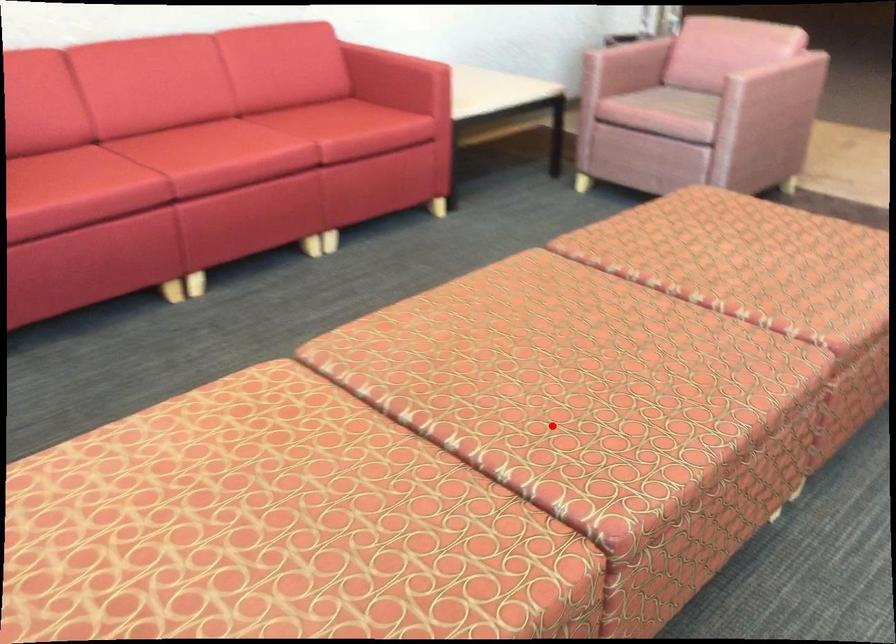
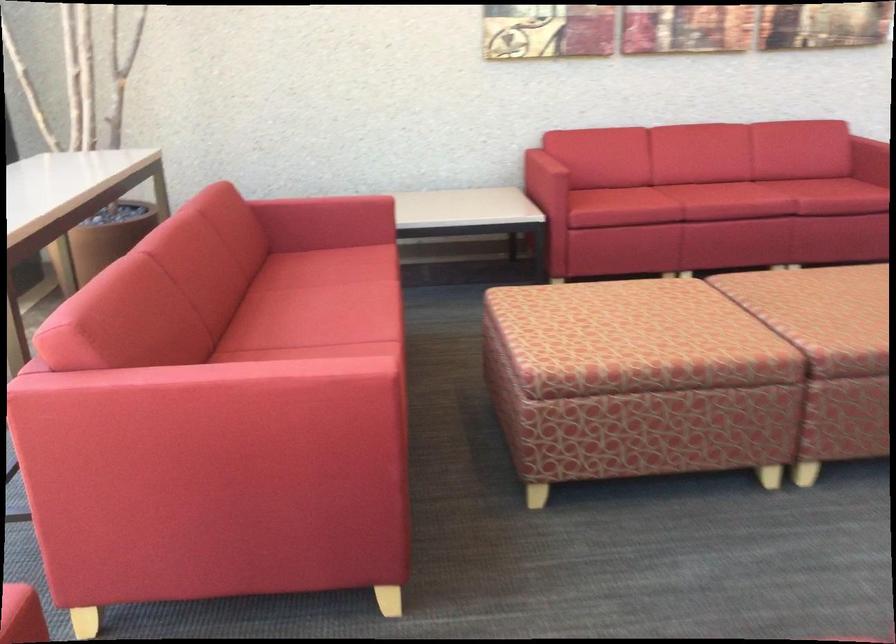
In the second image, find the point that corresponds to the highlighted location in the first image.

(834, 317)